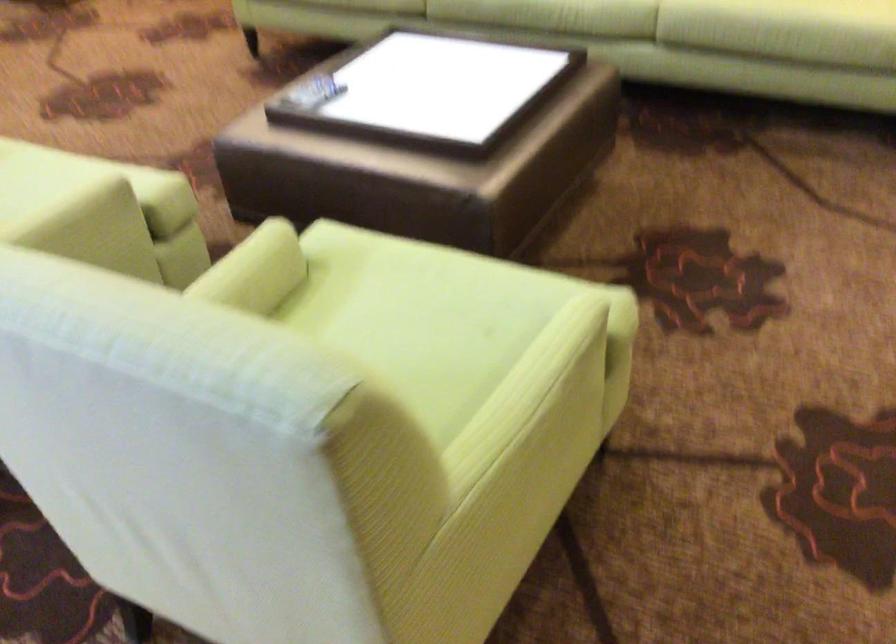
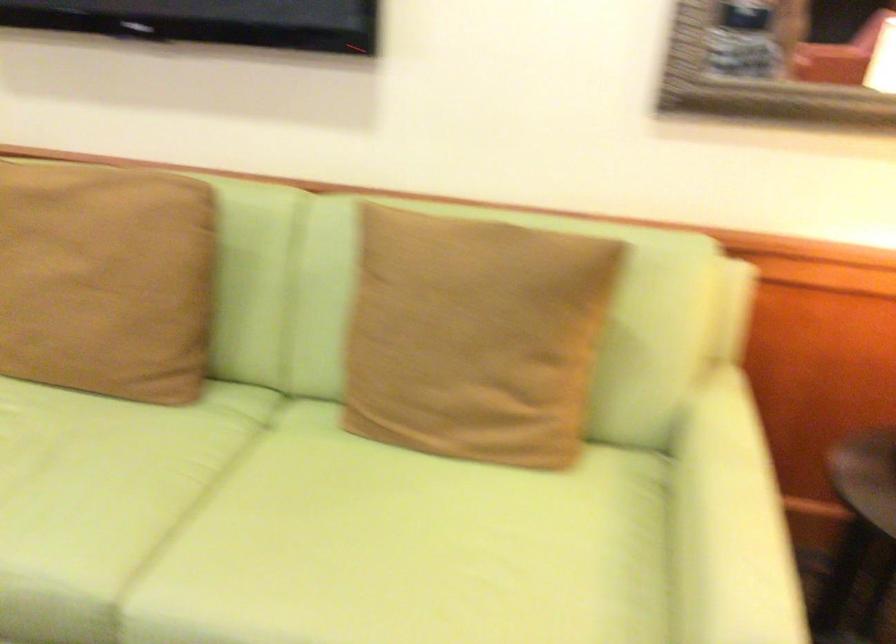
In a continuous first-person perspective shot, in which direction is the camera moving?

The cameraman moved toward right, forward.